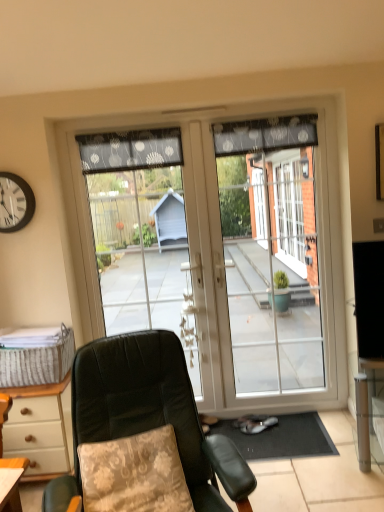
Question: Should I look upward or downward to see black plastic clock at upper left?

Choices:
 (A) down
 (B) up

Answer: (B)

Question: From the image's perspective, is black sheer curtain at upper center, which is the first curtain in right-to-left order, located above leather-like green chair at center?

Choices:
 (A) yes
 (B) no

Answer: (A)

Question: Is leather-like green chair at center at the back of black sheer curtain at upper center, which is the 2th curtain in left-to-right order?

Choices:
 (A) yes
 (B) no

Answer: (B)

Question: Is black sheer curtain at upper center, which is the 2th curtain in left-to-right order, taller than leather-like green chair at center?

Choices:
 (A) no
 (B) yes

Answer: (A)

Question: Considering the relative sizes of black sheer curtain at upper center, which is the 2th curtain in left-to-right order, and leather-like green chair at center in the image provided, is black sheer curtain at upper center, which is the 2th curtain in left-to-right order, wider than leather-like green chair at center?

Choices:
 (A) no
 (B) yes

Answer: (A)

Question: Is black sheer curtain at upper center, which is the first curtain in right-to-left order, positioned in front of leather-like green chair at center?

Choices:
 (A) no
 (B) yes

Answer: (A)

Question: Can you confirm if black sheer curtain at upper center, which is the first curtain in right-to-left order, is thinner than leather-like green chair at center?

Choices:
 (A) yes
 (B) no

Answer: (A)

Question: Considering the relative sizes of floral fabric pillow at lower left and black sheer curtain at upper center, which is the first curtain in right-to-left order, in the image provided, is floral fabric pillow at lower left thinner than black sheer curtain at upper center, which is the first curtain in right-to-left order,?

Choices:
 (A) yes
 (B) no

Answer: (B)

Question: Does floral fabric pillow at lower left have a smaller size compared to black sheer curtain at upper center, which is the 2th curtain in left-to-right order?

Choices:
 (A) no
 (B) yes

Answer: (A)

Question: Is floral fabric pillow at lower left facing away from black sheer curtain at upper center, which is the 2th curtain in left-to-right order?

Choices:
 (A) no
 (B) yes

Answer: (A)

Question: Would you say black sheer curtain at upper center, which is the first curtain in right-to-left order, is part of floral fabric pillow at lower left's contents?

Choices:
 (A) no
 (B) yes

Answer: (A)

Question: Does floral fabric pillow at lower left appear on the right side of black sheer curtain at upper center, which is the 2th curtain in left-to-right order?

Choices:
 (A) no
 (B) yes

Answer: (A)

Question: Is floral fabric pillow at lower left located outside black sheer curtain at upper center, which is the first curtain in right-to-left order?

Choices:
 (A) no
 (B) yes

Answer: (B)

Question: Considering the relative positions of dark gray dotted fabric at upper center, which ranks as the first curtain in left-to-right order, and transparent glass door at center in the image provided, is dark gray dotted fabric at upper center, which ranks as the first curtain in left-to-right order, to the left of transparent glass door at center from the viewer's perspective?

Choices:
 (A) no
 (B) yes

Answer: (B)